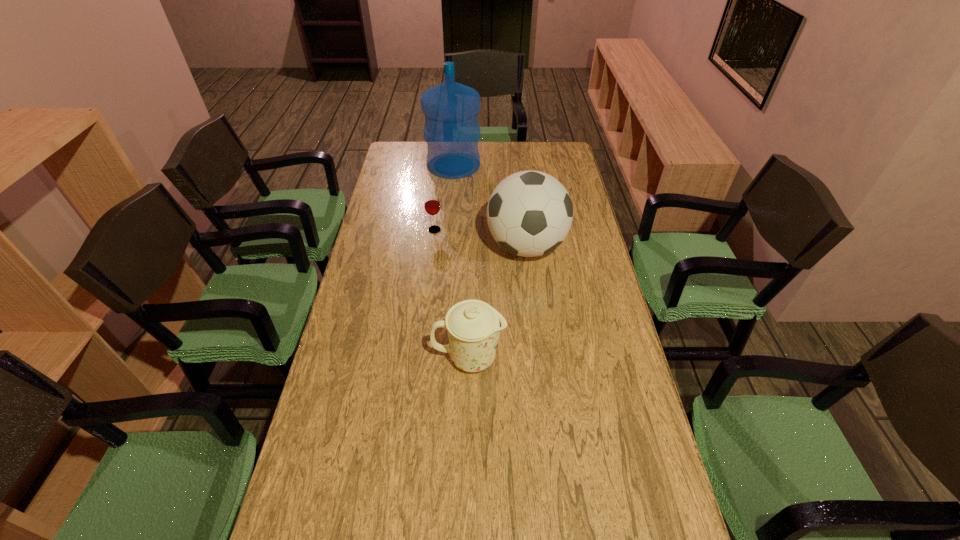
Locate an element on the screen. The height and width of the screenshot is (540, 960). empty space that is in between the glass and the chinaware is located at coordinates (452, 294).

What are the coordinates of `free area in between the tallest object and the shortest object` in the screenshot? It's located at (x=444, y=198).

Identify which object is the nearest to the soccer ball. Please provide its 2D coordinates. Your answer should be formatted as a tuple, i.e. [(x, y)], where the tuple contains the x and y coordinates of a point satisfying the conditions above.

[(432, 206)]

Locate an element on the screen. object that is the third closest to the chinaware is located at coordinates [x=451, y=131].